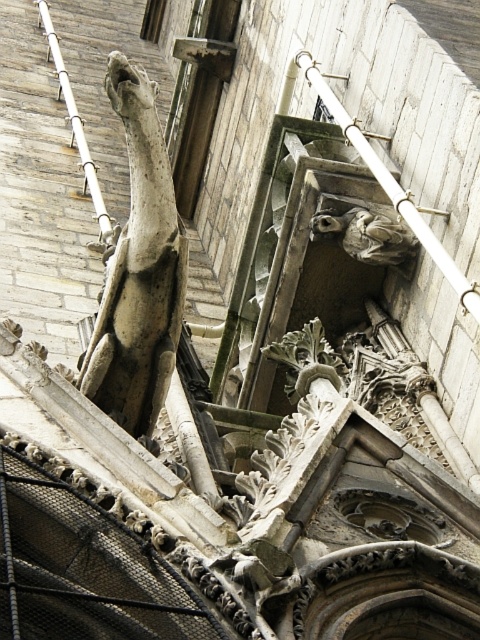
Does point (142, 177) come farther from viewer compared to point (382, 216)?

No.

Which of these two, gray stone gargoyle at upper left or gray stone gargoyle at upper center, stands shorter?

With less height is gray stone gargoyle at upper center.

Describe the element at coordinates (139, 269) in the screenshot. I see `gray stone gargoyle at upper left` at that location.

This screenshot has width=480, height=640. What are the coordinates of `gray stone gargoyle at upper left` in the screenshot? It's located at (139, 269).